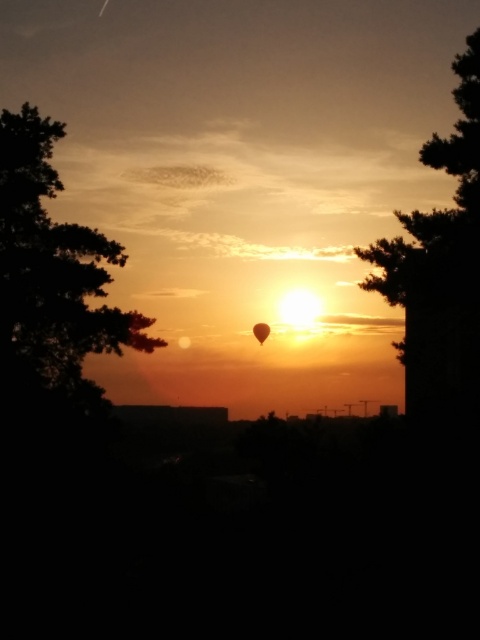
Based on the photo, you are standing in the sunset scene and want to place a small flag at one of the two points, point (x=37, y=237) or point (x=264, y=332). Which point is closer to you so the flag will be more visible?

Point (x=37, y=237) is closer to the viewer than point (x=264, y=332), so placing the flag there will make it more visible.

You are an artist planning to paint this sunset scene. You want to ensure the silky brown tree at right and the translucent orange balloon at center are proportionally accurate. Which object should you draw larger in your painting?

The silky brown tree at right should be drawn larger than the translucent orange balloon at center because it is bigger according to the description.